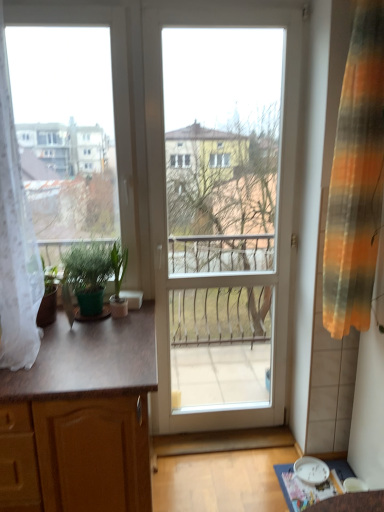
This screenshot has width=384, height=512. Find the location of `wooden cabinet at left`. wooden cabinet at left is located at coordinates (91, 412).

Looking at this image, what is the approximate width of green matte plant at left, which is the 1th houseplant in left-to-right order?

11.51 inches.

Image resolution: width=384 pixels, height=512 pixels. Describe the element at coordinates (16, 243) in the screenshot. I see `white lace curtain at left, acting as the second curtain starting from the right` at that location.

Identify the location of transparent glass window screen at left. click(67, 129).

Find the location of a particular element. wooden cabinet at left is located at coordinates (91, 412).

From the image's perspective, is green matte plant at left, positioned as the second houseplant in left-to-right order, beneath transparent glass window screen at left?

Indeed, from the image's perspective, green matte plant at left, positioned as the second houseplant in left-to-right order, is shown beneath transparent glass window screen at left.

From a real-world perspective, between green matte plant at left, which is the 1th houseplant in right-to-left order, and transparent glass window screen at left, who is vertically lower?

green matte plant at left, which is the 1th houseplant in right-to-left order, from a real-world perspective.

Find the location of a particular element. Image resolution: width=384 pixels, height=512 pixels. window screen that is above the green matte plant at left, which is the 1th houseplant in right-to-left order (from a real-world perspective) is located at coordinates (67, 129).

Is green matte plant at left, which is the 1th houseplant in right-to-left order, far from transparent glass window screen at left?

That's not correct — green matte plant at left, which is the 1th houseplant in right-to-left order, is a little close to transparent glass window screen at left.

Does point (123, 261) come closer to viewer compared to point (33, 259)?

No, (123, 261) is behind (33, 259).

Consider the image. Can you confirm if green matte plant at left, positioned as the second houseplant in left-to-right order, is smaller than white lace curtain at left, acting as the second curtain starting from the right?

Correct, green matte plant at left, positioned as the second houseplant in left-to-right order, occupies less space than white lace curtain at left, acting as the second curtain starting from the right.

Is white lace curtain at left, which is counted as the 1th curtain, starting from the left, inside green matte plant at left, positioned as the second houseplant in left-to-right order?

No, green matte plant at left, positioned as the second houseplant in left-to-right order, does not contain white lace curtain at left, which is counted as the 1th curtain, starting from the left.

Is green matte plant at left, which is the 1th houseplant in right-to-left order, aimed at white lace curtain at left, which is counted as the 1th curtain, starting from the left?

No, green matte plant at left, which is the 1th houseplant in right-to-left order, does not turn towards white lace curtain at left, which is counted as the 1th curtain, starting from the left.

Can you confirm if green matte plant at left, marked as the 2th houseplant in a right-to-left arrangement, is wider than green matte plant at left, which is the 1th houseplant in right-to-left order?

Correct, the width of green matte plant at left, marked as the 2th houseplant in a right-to-left arrangement, exceeds that of green matte plant at left, which is the 1th houseplant in right-to-left order.

How many degrees apart are the facing directions of green matte plant at left, marked as the 2th houseplant in a right-to-left arrangement, and green matte plant at left, which is the 1th houseplant in right-to-left order?

green matte plant at left, marked as the 2th houseplant in a right-to-left arrangement, and green matte plant at left, which is the 1th houseplant in right-to-left order, are facing 0.000743 degrees away from each other.

From a real-world perspective, is green matte plant at left, marked as the 2th houseplant in a right-to-left arrangement, beneath green matte plant at left, positioned as the second houseplant in left-to-right order?

No, from a real-world perspective, green matte plant at left, marked as the 2th houseplant in a right-to-left arrangement, is not under green matte plant at left, positioned as the second houseplant in left-to-right order.

Is white glossy door at center directly adjacent to transparent glass window screen at left?

No, white glossy door at center is not making contact with transparent glass window screen at left.

Considering the relative sizes of white glossy door at center and transparent glass window screen at left in the image provided, is white glossy door at center wider than transparent glass window screen at left?

Incorrect, the width of white glossy door at center does not surpass that of transparent glass window screen at left.

Measure the distance between white glossy door at center and transparent glass window screen at left.

white glossy door at center and transparent glass window screen at left are 27.23 inches apart.

Which of these two, white glossy door at center or transparent glass window screen at left, stands taller?

With more height is white glossy door at center.

Can we say green matte plant at left, positioned as the second houseplant in left-to-right order, lies outside white glossy door at center?

green matte plant at left, positioned as the second houseplant in left-to-right order, lies outside white glossy door at center's area.

Measure the distance from green matte plant at left, positioned as the second houseplant in left-to-right order, to white glossy door at center.

green matte plant at left, positioned as the second houseplant in left-to-right order, is 83.46 centimeters from white glossy door at center.

Could you tell me if green matte plant at left, positioned as the second houseplant in left-to-right order, is facing white glossy door at center?

No, green matte plant at left, positioned as the second houseplant in left-to-right order, is not turned towards white glossy door at center.

From the image's perspective, is green matte plant at left, which is the 1th houseplant in right-to-left order, over white glossy door at center?

No, from the image's perspective, green matte plant at left, which is the 1th houseplant in right-to-left order, is not above white glossy door at center.

Considering the relative sizes of white lace curtain at left, which is counted as the 1th curtain, starting from the left, and green matte plant at left, positioned as the second houseplant in left-to-right order, in the image provided, is white lace curtain at left, which is counted as the 1th curtain, starting from the left, wider than green matte plant at left, positioned as the second houseplant in left-to-right order,?

Yes.

From the image's perspective, between white lace curtain at left, acting as the second curtain starting from the right, and green matte plant at left, which is the 1th houseplant in right-to-left order, which one is located above?

white lace curtain at left, acting as the second curtain starting from the right, is shown above in the image.

From the picture: Is white lace curtain at left, which is counted as the 1th curtain, starting from the left, facing towards green matte plant at left, which is the 1th houseplant in right-to-left order?

No, white lace curtain at left, which is counted as the 1th curtain, starting from the left, is not facing towards green matte plant at left, which is the 1th houseplant in right-to-left order.

Identify the location of the 1st houseplant positioned below the striped fabric curtain at right, positioned as the 1th curtain in right-to-left order (from a real-world perspective). (93, 273).

Considering the sizes of objects striped fabric curtain at right, positioned as the 1th curtain in right-to-left order, and green matte plant at left, which is the 1th houseplant in left-to-right order, in the image provided, who is taller, striped fabric curtain at right, positioned as the 1th curtain in right-to-left order, or green matte plant at left, which is the 1th houseplant in left-to-right order,?

striped fabric curtain at right, positioned as the 1th curtain in right-to-left order, is taller.

Does point (363, 70) come closer to viewer compared to point (67, 253)?

Yes, it is.

At what (x,y) coordinates should I click in order to perform the action: click on window screen on the left of green matte plant at left, which is the 1th houseplant in right-to-left order. Please return your answer as a coordinate pair (x, y). The height and width of the screenshot is (512, 384). Looking at the image, I should click on (67, 129).

From a real-world perspective, count 2nd houseplants downward from the white lace curtain at left, which is counted as the 1th curtain, starting from the left, and point to it. Please provide its 2D coordinates.

[(118, 280)]

Looking at this image, from the image, which object appears to be farther from green matte plant at left, positioned as the second houseplant in left-to-right order, white lace curtain at left, which is counted as the 1th curtain, starting from the left, or wooden cabinet at left?

white lace curtain at left, which is counted as the 1th curtain, starting from the left, lies further to green matte plant at left, positioned as the second houseplant in left-to-right order, than the other object.

Based on the photo, looking at the image, which one is located closer to white lace curtain at left, acting as the second curtain starting from the right, striped fabric curtain at right, positioned as the 1th curtain in right-to-left order, or green matte plant at left, which is the 1th houseplant in left-to-right order?

Based on the image, green matte plant at left, which is the 1th houseplant in left-to-right order, appears to be nearer to white lace curtain at left, acting as the second curtain starting from the right.

Looking at the image, which one is located further to green matte plant at left, which is the 1th houseplant in left-to-right order, striped fabric curtain at right, positioned as the 1th curtain in right-to-left order, or white glossy door at center?

Based on the image, striped fabric curtain at right, positioned as the 1th curtain in right-to-left order, appears to be further to green matte plant at left, which is the 1th houseplant in left-to-right order.

Estimate the real-world distances between objects in this image. Which object is further from white glossy door at center, white lace curtain at left, which is counted as the 1th curtain, starting from the left, or wooden cabinet at left?

The object further to white glossy door at center is white lace curtain at left, which is counted as the 1th curtain, starting from the left.

Which object lies further to the anchor point white lace curtain at left, acting as the second curtain starting from the right, transparent glass window screen at left or striped fabric curtain at right, the 2th curtain in the left-to-right sequence?

striped fabric curtain at right, the 2th curtain in the left-to-right sequence, lies further to white lace curtain at left, acting as the second curtain starting from the right, than the other object.

Considering their positions, is green matte plant at left, positioned as the second houseplant in left-to-right order, positioned further to wooden cabinet at left than green matte plant at left, marked as the 2th houseplant in a right-to-left arrangement?

green matte plant at left, positioned as the second houseplant in left-to-right order, is positioned further to the anchor wooden cabinet at left.

Based on their spatial positions, is transparent glass window screen at left or wooden cabinet at left closer to green matte plant at left, which is the 1th houseplant in right-to-left order?

wooden cabinet at left is closer to green matte plant at left, which is the 1th houseplant in right-to-left order.

Considering their positions, is green matte plant at left, marked as the 2th houseplant in a right-to-left arrangement, positioned closer to white lace curtain at left, acting as the second curtain starting from the right, than green matte plant at left, positioned as the second houseplant in left-to-right order?

Based on the image, green matte plant at left, marked as the 2th houseplant in a right-to-left arrangement, appears to be nearer to white lace curtain at left, acting as the second curtain starting from the right.

Identify the location of window screen between white lace curtain at left, acting as the second curtain starting from the right, and green matte plant at left, marked as the 2th houseplant in a right-to-left arrangement, from front to back. This screenshot has width=384, height=512. (67, 129).

The width and height of the screenshot is (384, 512). I want to click on door situated between wooden cabinet at left and striped fabric curtain at right, positioned as the 1th curtain in right-to-left order, from left to right, so click(x=221, y=209).

Find the location of a particular element. Image resolution: width=384 pixels, height=512 pixels. cabinetry situated between white lace curtain at left, acting as the second curtain starting from the right, and striped fabric curtain at right, positioned as the 1th curtain in right-to-left order, from left to right is located at coordinates (91, 412).

The height and width of the screenshot is (512, 384). Find the location of `window screen between white lace curtain at left, which is counted as the 1th curtain, starting from the left, and white glossy door at center`. window screen between white lace curtain at left, which is counted as the 1th curtain, starting from the left, and white glossy door at center is located at coordinates (67, 129).